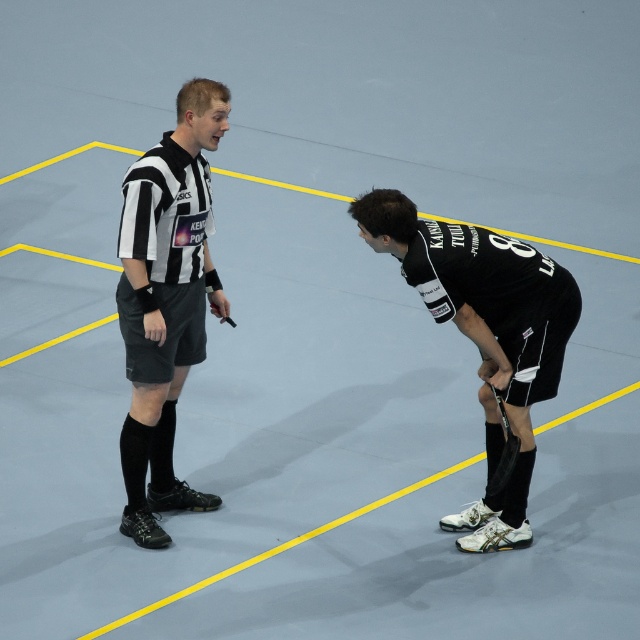
Question: Which point is closer to the camera?

Choices:
 (A) (448, 525)
 (B) (150, 470)

Answer: (A)

Question: Is black/white striped shirt at center to the right of black matte hockey stick at lower right from the viewer's perspective?

Choices:
 (A) no
 (B) yes

Answer: (A)

Question: Which point appears closest to the camera in this image?

Choices:
 (A) (490, 356)
 (B) (147, 440)

Answer: (A)

Question: Can you confirm if black/white striped shirt at center is positioned to the left of black matte hockey stick at lower right?

Choices:
 (A) no
 (B) yes

Answer: (B)

Question: Which of the following is the closest to the observer?

Choices:
 (A) black/white striped shirt at center
 (B) black matte hockey stick at lower right

Answer: (A)

Question: Does black/white striped shirt at center have a smaller size compared to black matte hockey stick at lower right?

Choices:
 (A) no
 (B) yes

Answer: (B)